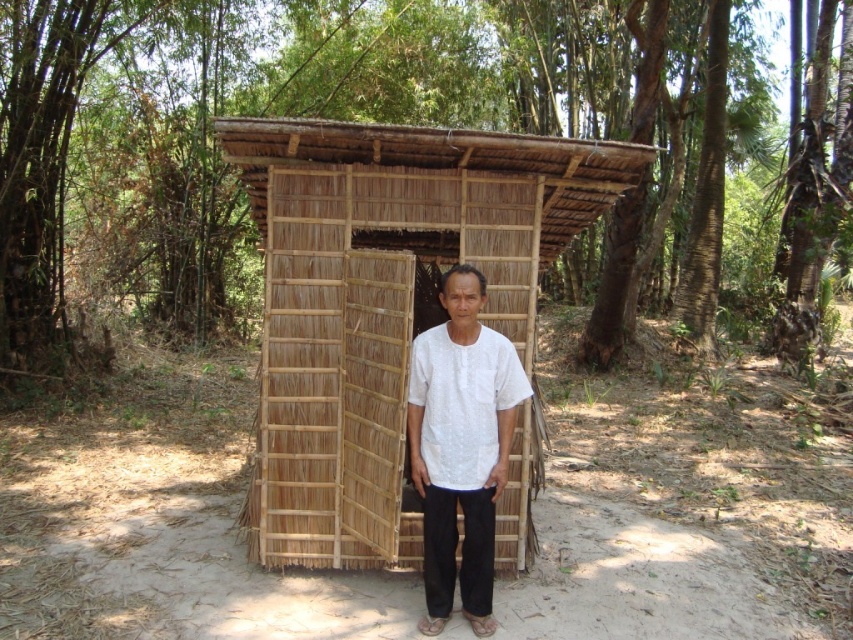
Can you confirm if bamboo mat hut at center is wider than white cotton shirt at center?

Yes, bamboo mat hut at center is wider than white cotton shirt at center.

How much distance is there between bamboo mat hut at center and white cotton shirt at center?

bamboo mat hut at center is 24.30 inches away from white cotton shirt at center.

You are a GUI agent. You are given a task and a screenshot of the screen. Output one action in this format:
    pyautogui.click(x=<x>, y=<y>)
    Task: Click on the bamboo mat hut at center
    The image size is (853, 640).
    Given the screenshot: What is the action you would take?
    pyautogui.click(x=384, y=300)

Which is in front, point (798, 308) or point (476, 458)?

Point (476, 458) is in front.

Who is more distant from viewer, (567, 252) or (445, 330)?

Point (567, 252)

Locate an element on the screen. natural brown bamboo forest at center is located at coordinates (332, 147).

Is natural brown bamboo forest at center closer to camera compared to bamboo mat hut at center?

That is False.

Can you confirm if natural brown bamboo forest at center is positioned to the left of bamboo mat hut at center?

Incorrect, natural brown bamboo forest at center is not on the left side of bamboo mat hut at center.

The image size is (853, 640). What do you see at coordinates (332, 147) in the screenshot?
I see `natural brown bamboo forest at center` at bounding box center [332, 147].

Find the location of a particular element. The image size is (853, 640). natural brown bamboo forest at center is located at coordinates (332, 147).